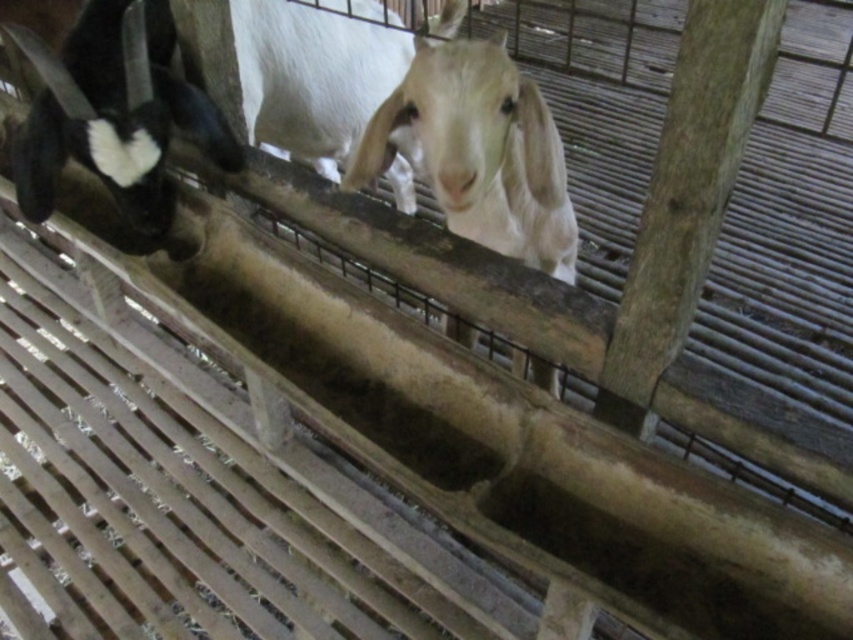
You are a farmer checking the enclosure for space. You see the white woolen goat at center and the white matte goat at center. Which goat takes up more space in the enclosure?

The white matte goat at center occupies more space than the white woolen goat at center, as the white woolen goat at center occupies less space than white matte goat at center.

You are a farmer checking the goats in the enclosure. You need to identify which goat is larger. Which one is bigger between the white woolen goat at center and the white matte goat at upper center?

The white woolen goat at center is bigger than the white matte goat at upper center.